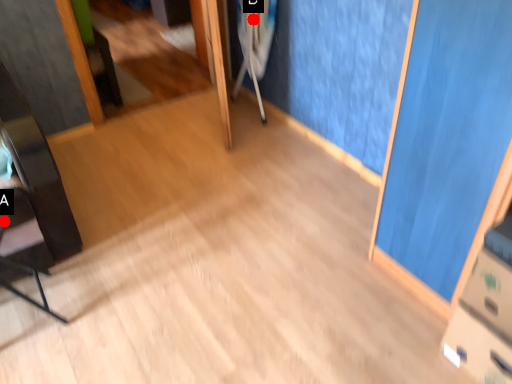
Question: Two points are circled on the image, labeled by A and B beside each circle. Which of the following is the farthest from the observer?

Choices:
 (A) A is further
 (B) B is further

Answer: (B)